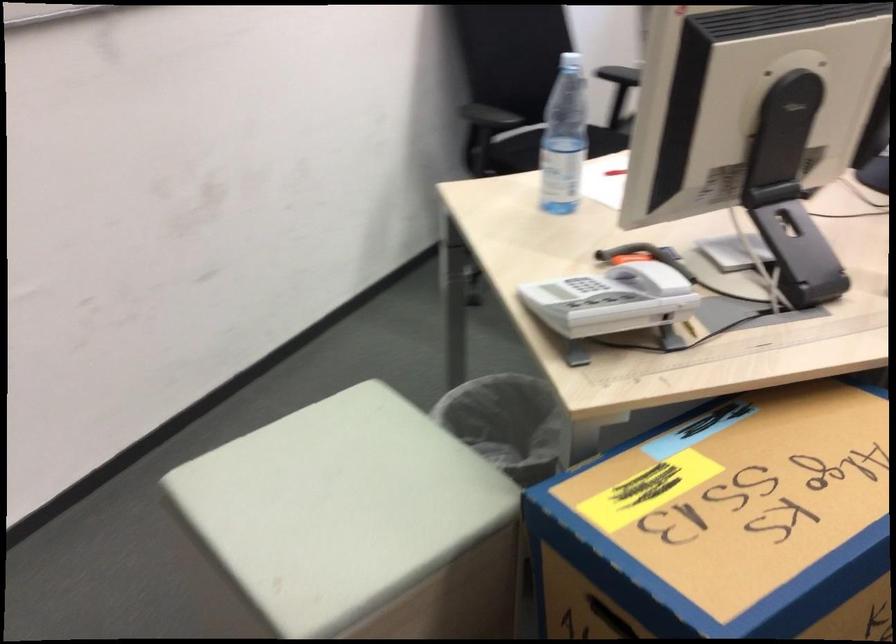
Describe the element at coordinates (488, 117) in the screenshot. I see `the black chair armrest` at that location.